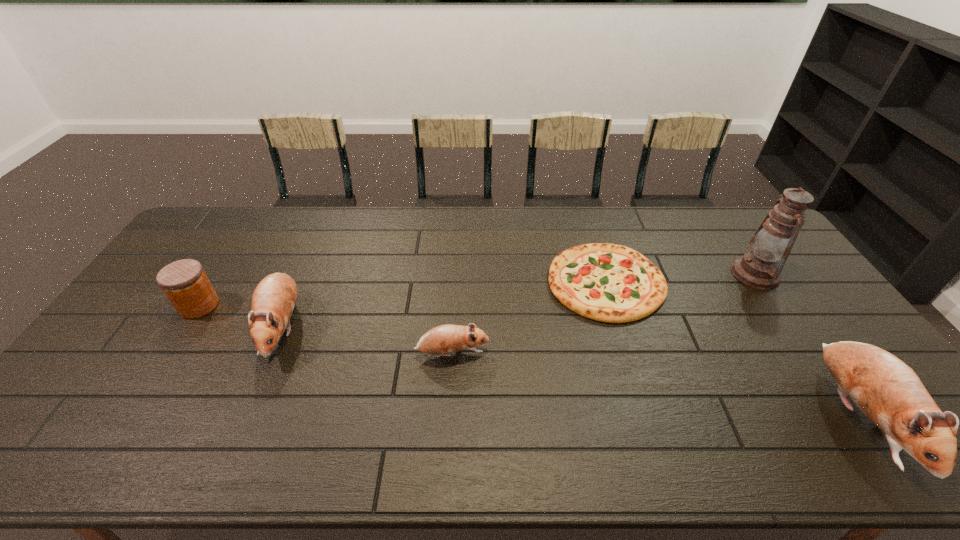
At what (x,y) coordinates should I click in order to perform the action: click on spot to insert another hamster for uniform distribution. Please return your answer as a coordinate pair (x, y). This screenshot has width=960, height=540. Looking at the image, I should click on (642, 383).